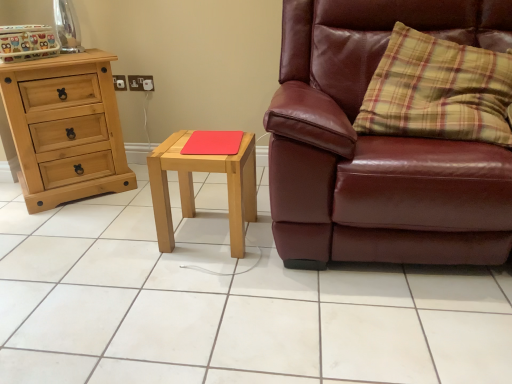
Image resolution: width=512 pixels, height=384 pixels. Find the location of `free space above red matte mousepad at center (from a real-world perspective)`. free space above red matte mousepad at center (from a real-world perspective) is located at coordinates (208, 137).